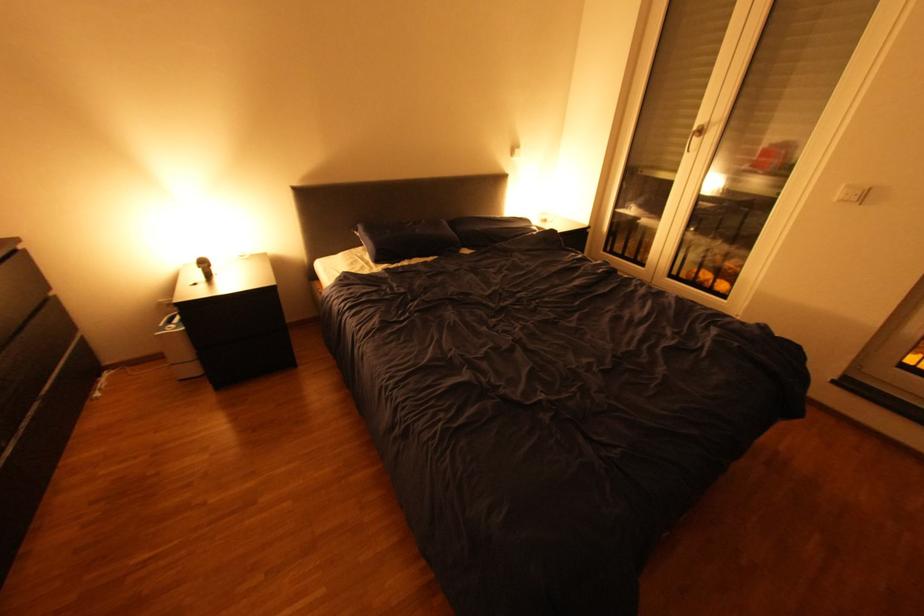
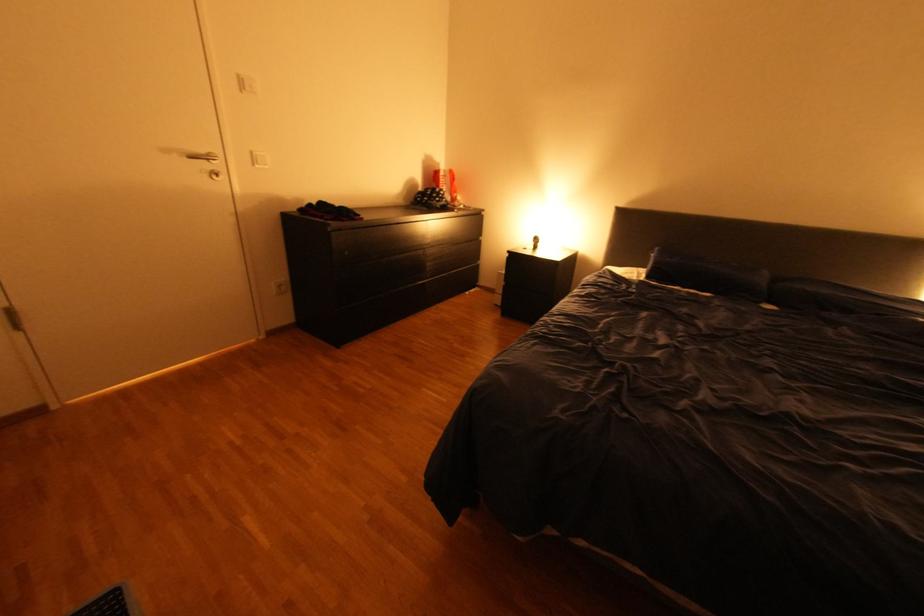
Question: The first image is from the beginning of the video and the second image is from the end. How did the camera likely rotate when shooting the video?

Choices:
 (A) Left
 (B) Right
 (C) Up
 (D) Down

Answer: (A)